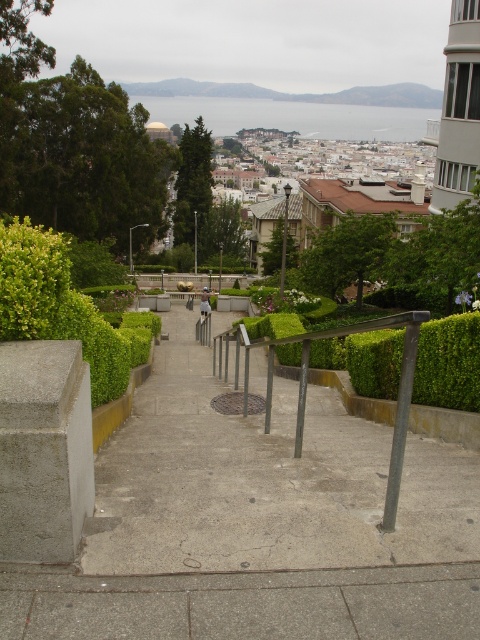
Who is positioned more to the right, gray concrete pavement at center or light brown wooden bench at center?

gray concrete pavement at center is more to the right.

Does point (81, 596) come behind point (204, 316)?

No, (81, 596) is closer to viewer.

Does point (142, 385) come in front of point (202, 310)?

Yes, point (142, 385) is in front of point (202, 310).

Image resolution: width=480 pixels, height=640 pixels. Identify the location of gray concrete pavement at center. (257, 524).

The image size is (480, 640). Describe the element at coordinates (257, 524) in the screenshot. I see `gray concrete pavement at center` at that location.

Which is more to the left, gray concrete pavement at center or light brown wooden stick at center?

light brown wooden stick at center

Between point (369, 598) and point (207, 296), which one is positioned behind?

The point (207, 296) is behind.

Locate an element on the screen. This screenshot has height=640, width=480. gray concrete pavement at center is located at coordinates click(x=257, y=524).

Looking at this image, does gray concrete pavement at center appear on the left side of metallic gray railing at center?

Indeed, gray concrete pavement at center is positioned on the left side of metallic gray railing at center.

Where is `gray concrete pavement at center`? gray concrete pavement at center is located at coordinates (257, 524).